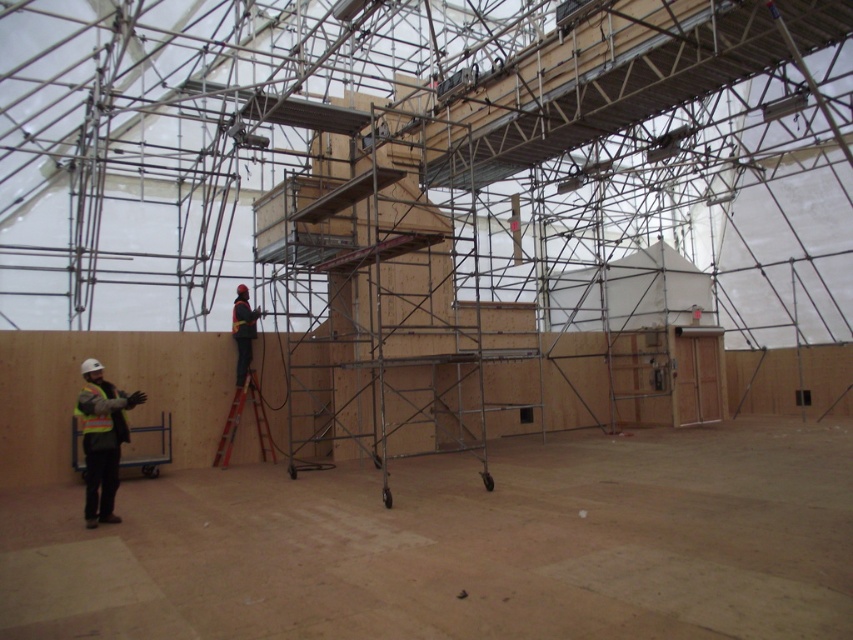
You are a safety inspector standing at the entrance of the construction site. You see the reflective yellow safety vest at lower left and the dark blue fabric construction worker at center. Which object is nearer to you?

The reflective yellow safety vest at lower left is closer to the viewer than the dark blue fabric construction worker at center.

You are an inspector standing at the entrance of the construction site. You notice two points marked on the scaffolding structure. The first point is at coordinates point (119, 394) and the second is at point (241, 380). Which point is closer to your current position?

Point (119, 394) is closer to the camera than point (241, 380), so the first point is closer to your current position.